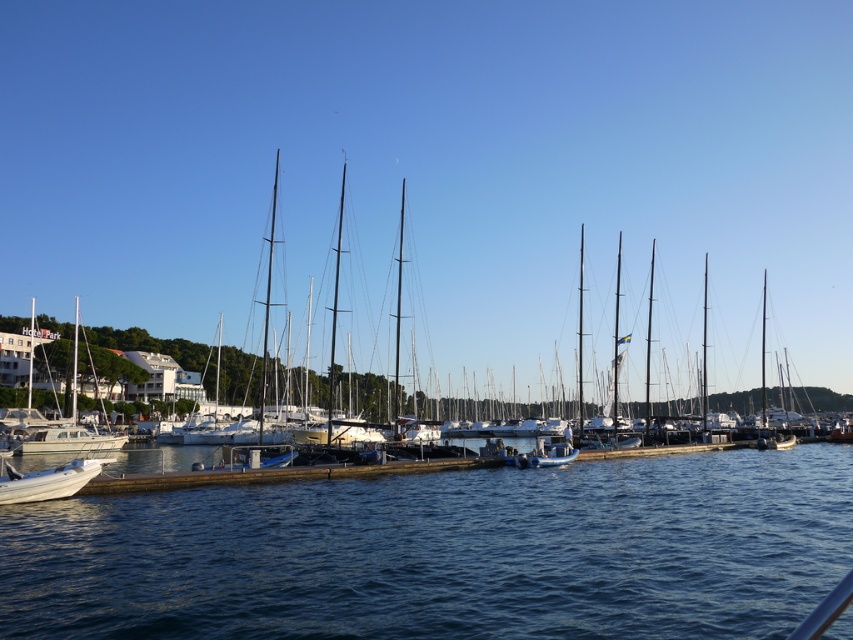
Question: Does blue water at lower center lie behind white glossy sailboat at left?

Choices:
 (A) yes
 (B) no

Answer: (B)

Question: Which of these objects is positioned farthest from the white glossy sailboat at left?

Choices:
 (A) blue rubber dinghy at center
 (B) blue water at lower center

Answer: (A)

Question: Can you confirm if white matte boat at lower left is bigger than blue rubber dinghy at center?

Choices:
 (A) yes
 (B) no

Answer: (A)

Question: Considering the real-world distances, which object is farthest from the blue water at lower center?

Choices:
 (A) blue rubber dinghy at center
 (B) white glossy sailboat at left
 (C) white matte boat at lower left

Answer: (B)

Question: Does blue water at lower center appear over white matte boat at lower left?

Choices:
 (A) no
 (B) yes

Answer: (A)

Question: Which of these objects is positioned closest to the white matte boat at lower left?

Choices:
 (A) blue water at lower center
 (B) blue rubber dinghy at center
 (C) white glossy sailboat at left

Answer: (A)